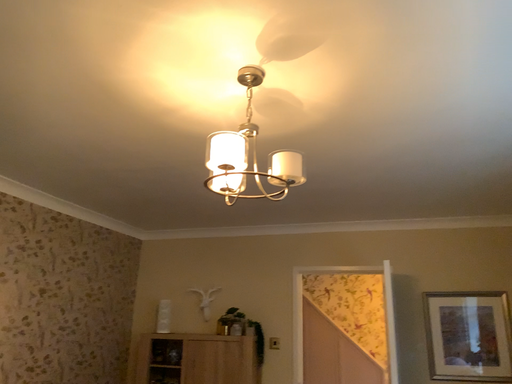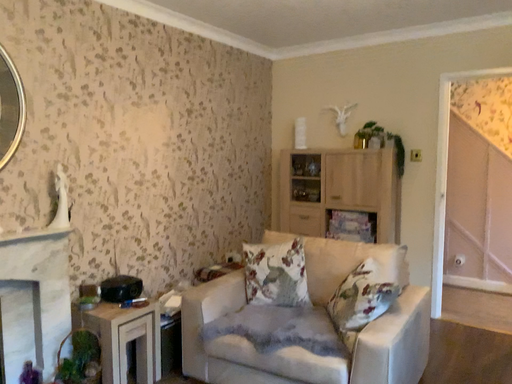
Question: How did the camera likely rotate when shooting the video?

Choices:
 (A) rotated downward
 (B) rotated upward

Answer: (A)